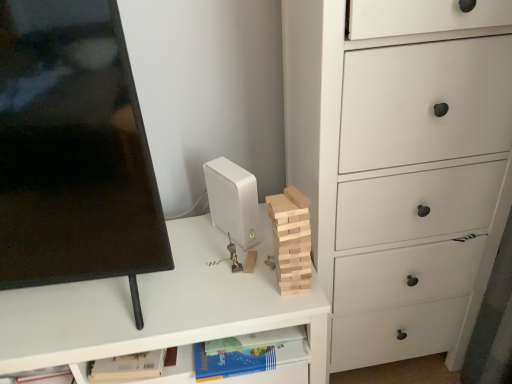
Where is `empty space that is ontop of white matte desktop computer at center (from a real-world perspective)`? The width and height of the screenshot is (512, 384). empty space that is ontop of white matte desktop computer at center (from a real-world perspective) is located at coordinates (228, 170).